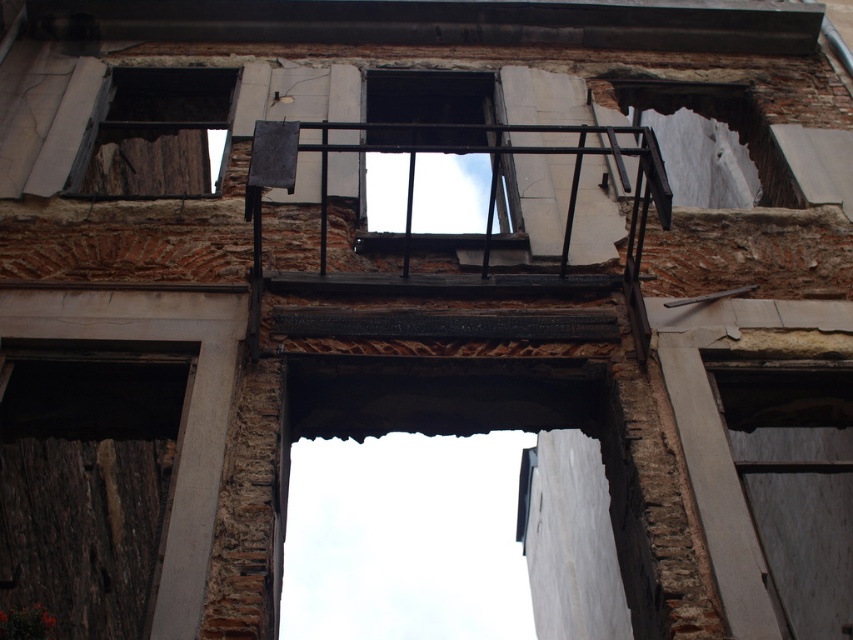
Does smooth white window at lower right have a greater width compared to metallic black balcony at center?

Incorrect, smooth white window at lower right's width does not surpass metallic black balcony at center's.

Can you confirm if smooth white window at lower right is positioned below metallic black balcony at center?

Indeed, smooth white window at lower right is positioned under metallic black balcony at center.

Does point (837, 577) lie behind point (399, 83)?

No, (837, 577) is in front of (399, 83).

At what (x,y) coordinates should I click in order to perform the action: click on smooth white window at lower right. Please return your answer as a coordinate pair (x, y). The height and width of the screenshot is (640, 853). Looking at the image, I should click on (795, 483).

Which is below, metallic black balcony at center or dark brown wood at upper left?

Positioned lower is dark brown wood at upper left.

Which of these two, metallic black balcony at center or dark brown wood at upper left, stands shorter?

With less height is dark brown wood at upper left.

Measure the distance between point (x=396, y=106) and camera.

Point (x=396, y=106) and camera are 70.30 feet apart.

Identify the location of metallic black balcony at center. 428,97.

Who is taller, smooth white window at lower right or dark brown wood at upper left?

smooth white window at lower right

Is smooth white window at lower right below dark brown wood at upper left?

Yes, smooth white window at lower right is below dark brown wood at upper left.

Where is `smooth white window at lower right`? The height and width of the screenshot is (640, 853). smooth white window at lower right is located at coordinates tap(795, 483).